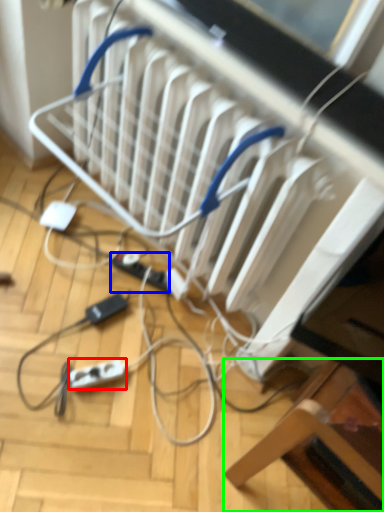
Question: Which is nearer to the extension cord (highlighted by a red box)? extension cord (highlighted by a blue box) or furniture (highlighted by a green box).

Choices:
 (A) extension cord
 (B) furniture

Answer: (A)